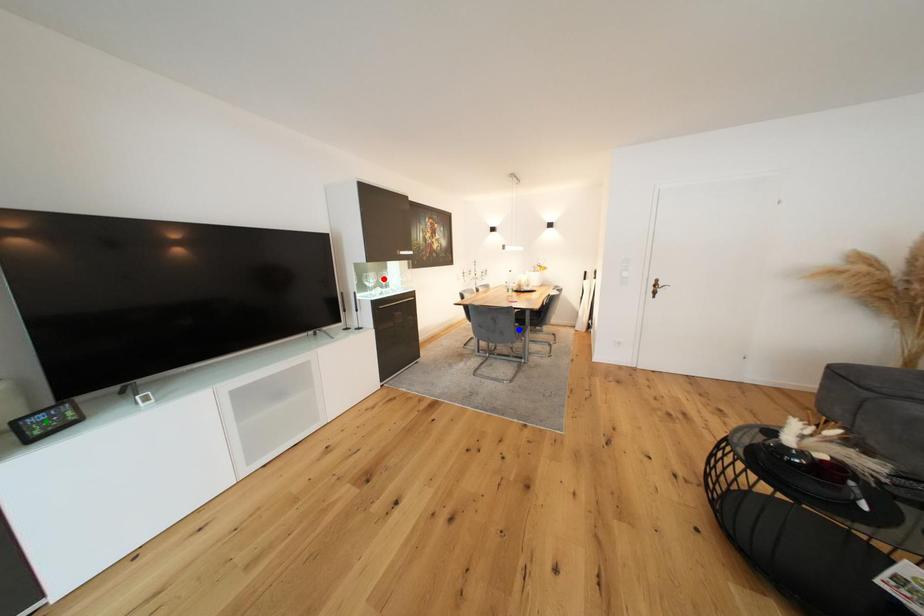
Order these from nearest to farthest:
red point, blue point, green point

green point < blue point < red point